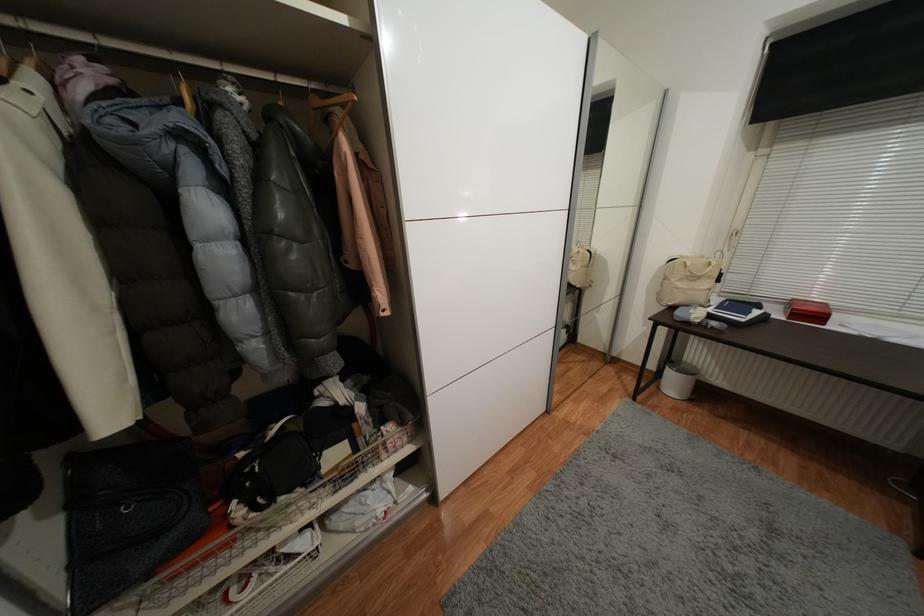
Describe the element at coordinates (699, 265) in the screenshot. I see `a beige backpack handle` at that location.